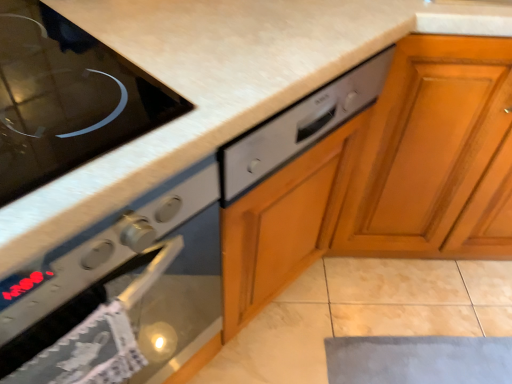
This screenshot has width=512, height=384. In order to click on satin silver oven at left in this screenshot , I will do `click(121, 292)`.

The width and height of the screenshot is (512, 384). Find the location of `satin silver dishwasher at center`. satin silver dishwasher at center is located at coordinates (300, 126).

Locate an element on the screen. black glass cooktop at upper left is located at coordinates (65, 98).

Can you confirm if satin silver oven at left is bigger than satin silver dishwasher at center?

Indeed, satin silver oven at left has a larger size compared to satin silver dishwasher at center.

Considering the relative sizes of satin silver oven at left and satin silver dishwasher at center in the image provided, is satin silver oven at left shorter than satin silver dishwasher at center?

In fact, satin silver oven at left may be taller than satin silver dishwasher at center.

Considering the relative positions of satin silver oven at left and satin silver dishwasher at center in the image provided, is satin silver oven at left in front of satin silver dishwasher at center?

Yes, satin silver oven at left is in front of satin silver dishwasher at center.

From the image's perspective, which object appears higher, satin silver oven at left or satin silver dishwasher at center?

satin silver dishwasher at center.

Considering the sizes of objects satin silver oven at left and wooden cabinet at right in the image provided, who is wider, satin silver oven at left or wooden cabinet at right?

wooden cabinet at right.

Does point (166, 224) lie behind point (450, 47)?

No.

The height and width of the screenshot is (384, 512). Identify the location of cabinetry located behind the satin silver oven at left. (431, 151).

Considering the sizes of objects satin silver oven at left and wooden cabinet at right in the image provided, who is shorter, satin silver oven at left or wooden cabinet at right?

Standing shorter between the two is satin silver oven at left.

In terms of height, does satin silver dishwasher at center look taller or shorter compared to satin silver oven at left?

Clearly, satin silver dishwasher at center is shorter compared to satin silver oven at left.

Is satin silver dishwasher at center not within satin silver oven at left?

Indeed, satin silver dishwasher at center is completely outside satin silver oven at left.

From a real-world perspective, relative to satin silver oven at left, is satin silver dishwasher at center vertically above or below?

Clearly, from a real-world perspective, satin silver dishwasher at center is above satin silver oven at left.

From the image's perspective, is satin silver dishwasher at center beneath satin silver oven at left?

No.

Is wooden cabinet at right looking in the opposite direction of black glass cooktop at upper left?

No, wooden cabinet at right is not facing away from black glass cooktop at upper left.

Which object is closer to the camera, wooden cabinet at right or black glass cooktop at upper left?

black glass cooktop at upper left is in front.

Is wooden cabinet at right far from satin silver oven at left?

No, there isn't a large distance between wooden cabinet at right and satin silver oven at left.

Based on the photo, is wooden cabinet at right completely or partially outside of satin silver oven at left?

Indeed, wooden cabinet at right is completely outside satin silver oven at left.

Looking at this image, from the image's perspective, does wooden cabinet at right appear lower than satin silver oven at left?

No.

Considering the positions of point (398, 51) and point (157, 270), is point (398, 51) closer or farther from the camera than point (157, 270)?

Point (398, 51) appears to be farther away from the viewer than point (157, 270).

Is satin silver dishwasher at center beside wooden cabinet at right?

No, satin silver dishwasher at center is not touching wooden cabinet at right.

Would you say wooden cabinet at right is part of satin silver dishwasher at center's contents?

Definitely not — wooden cabinet at right is not inside satin silver dishwasher at center.

Who is more distant, satin silver dishwasher at center or wooden cabinet at right?

Positioned behind is wooden cabinet at right.

Does satin silver dishwasher at center appear on the right side of wooden cabinet at right?

In fact, satin silver dishwasher at center is to the left of wooden cabinet at right.

From the picture: From a real-world perspective, between black glass cooktop at upper left and satin silver dishwasher at center, who is vertically higher?

From a 3D spatial view, black glass cooktop at upper left is above.

Looking at this image, are black glass cooktop at upper left and satin silver dishwasher at center far apart?

No, there isn't a large distance between black glass cooktop at upper left and satin silver dishwasher at center.

Considering the points (82, 104) and (325, 110), which point is behind, point (82, 104) or point (325, 110)?

Positioned behind is point (325, 110).

In the image, there is a satin silver dishwasher at center. At what (x,y) coordinates should I click in order to perform the action: click on oven below it (from the image's perspective). Please return your answer as a coordinate pair (x, y). This screenshot has width=512, height=384. Looking at the image, I should click on (121, 292).

Locate an element on the screen. This screenshot has height=384, width=512. cabinetry located above the satin silver oven at left (from the image's perspective) is located at coordinates (431, 151).

From the image, which object appears to be nearer to satin silver oven at left, black glass cooktop at upper left or wooden cabinet at right?

Based on the image, black glass cooktop at upper left appears to be nearer to satin silver oven at left.

Considering their positions, is wooden cabinet at right positioned further to satin silver oven at left than satin silver dishwasher at center?

wooden cabinet at right is further to satin silver oven at left.

Looking at the image, which one is located closer to satin silver oven at left, black glass cooktop at upper left or satin silver dishwasher at center?

The object closer to satin silver oven at left is satin silver dishwasher at center.

When comparing their distances from wooden cabinet at right, does satin silver dishwasher at center or black glass cooktop at upper left seem closer?

satin silver dishwasher at center is closer to wooden cabinet at right.

When comparing their distances from wooden cabinet at right, does black glass cooktop at upper left or satin silver oven at left seem closer?

satin silver oven at left is closer to wooden cabinet at right.

Based on their spatial positions, is satin silver oven at left or satin silver dishwasher at center closer to wooden cabinet at right?

satin silver dishwasher at center.

From the image, which object appears to be farther from satin silver dishwasher at center, black glass cooktop at upper left or satin silver oven at left?

black glass cooktop at upper left lies further to satin silver dishwasher at center than the other object.

Considering their positions, is satin silver dishwasher at center positioned closer to black glass cooktop at upper left than satin silver oven at left?

satin silver oven at left.

This screenshot has height=384, width=512. I want to click on drawer situated between satin silver oven at left and wooden cabinet at right from left to right, so click(x=300, y=126).

Where is `oven between black glass cooktop at upper left and satin silver dishwasher at center from left to right`? The image size is (512, 384). oven between black glass cooktop at upper left and satin silver dishwasher at center from left to right is located at coordinates (121, 292).

Identify the location of oven situated between black glass cooktop at upper left and wooden cabinet at right from left to right. The height and width of the screenshot is (384, 512). (121, 292).

The image size is (512, 384). I want to click on drawer located between black glass cooktop at upper left and wooden cabinet at right in the left-right direction, so click(x=300, y=126).